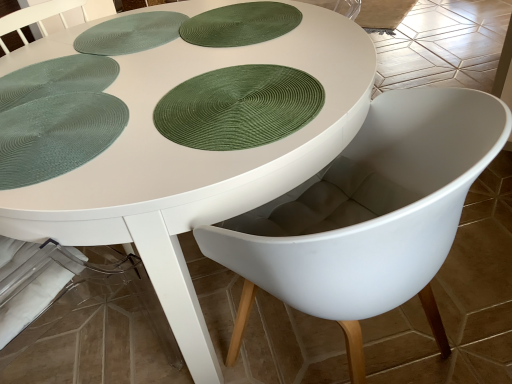
The height and width of the screenshot is (384, 512). Identify the location of free space that is in between green textured placemat at upper left, which appears as the 3th paper plate when ordered from the bottom, and green textured placemat at left, marked as the first paper plate in a bottom-to-top arrangement. (132, 87).